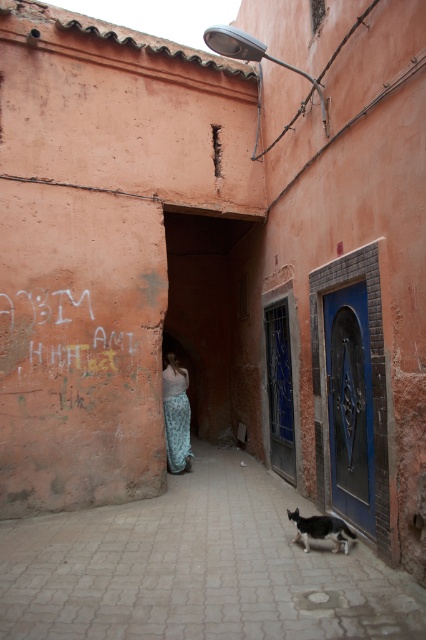
Question: Is smooth stone alley at center to the right of patterned fabric dress at center from the viewer's perspective?

Choices:
 (A) no
 (B) yes

Answer: (B)

Question: Which point is farther to the camera?

Choices:
 (A) smooth stone alley at center
 (B) patterned fabric dress at center
 (C) black and white fur cat at lower right

Answer: (B)

Question: Does patterned fabric dress at center come in front of black and white fur cat at lower right?

Choices:
 (A) no
 (B) yes

Answer: (A)

Question: Which point is farther to the camera?

Choices:
 (A) smooth stone alley at center
 (B) patterned fabric dress at center

Answer: (B)

Question: Can you confirm if patterned fabric dress at center is positioned to the left of black and white fur cat at lower right?

Choices:
 (A) no
 (B) yes

Answer: (B)

Question: Which point is farther from the camera taking this photo?

Choices:
 (A) (183, 413)
 (B) (339, 525)

Answer: (A)